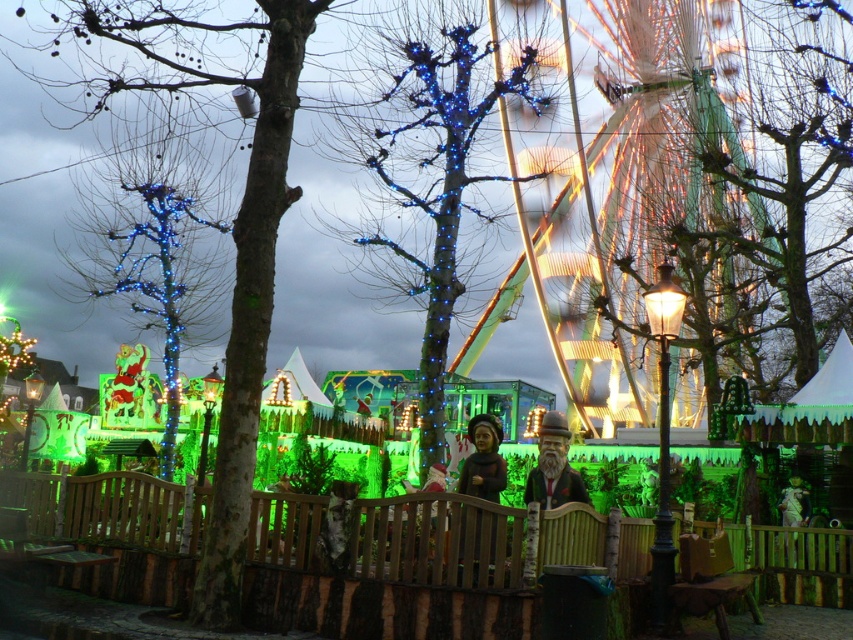
Question: Among these objects, which one is nearest to the camera?

Choices:
 (A) matte brown wooden figure at center
 (B) wooden statue at center
 (C) blue led lights at center
 (D) blue metallic tree at left

Answer: (D)

Question: Is blue metallic tree at left wider than blue illuminated tree at left?

Choices:
 (A) yes
 (B) no

Answer: (A)

Question: Is blue metallic tree at left below blue illuminated tree at left?

Choices:
 (A) no
 (B) yes

Answer: (A)

Question: Does blue illuminated tree at left have a lesser width compared to blue led lights at center?

Choices:
 (A) no
 (B) yes

Answer: (B)

Question: Which of the following is the closest to the observer?

Choices:
 (A) illuminated metal ferris wheel at upper right
 (B) matte brown wooden figure at center
 (C) wooden statue at center

Answer: (B)

Question: Which point is farther from the camera taking this photo?

Choices:
 (A) (494, 442)
 (B) (223, 422)

Answer: (A)